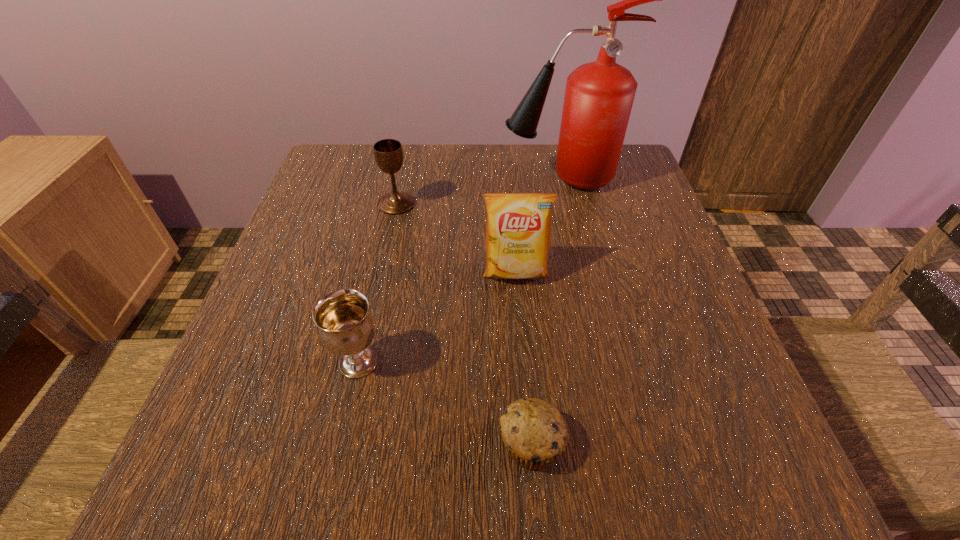
Image resolution: width=960 pixels, height=540 pixels. I want to click on free space that is in between the farther chalice and the fourth farthest object, so click(x=378, y=283).

Locate an element on the screen. This screenshot has width=960, height=540. empty space that is in between the farther chalice and the second nearest object is located at coordinates (378, 283).

Find the location of a particular element. Image resolution: width=960 pixels, height=540 pixels. free space between the fire extinguisher and the farther chalice is located at coordinates (478, 191).

Where is `vacant area between the third farthest object and the farther chalice`? The width and height of the screenshot is (960, 540). vacant area between the third farthest object and the farther chalice is located at coordinates (456, 239).

Locate an element on the screen. This screenshot has width=960, height=540. empty space between the crisp (potato chip) and the nearer chalice is located at coordinates (437, 318).

Select which object appears as the fourth closest to the tallest object. Please provide its 2D coordinates. Your answer should be formatted as a tuple, i.e. [(x, y)], where the tuple contains the x and y coordinates of a point satisfying the conditions above.

[(534, 432)]

Locate which object is the third closest to the shortest object. Please provide its 2D coordinates. Your answer should be formatted as a tuple, i.e. [(x, y)], where the tuple contains the x and y coordinates of a point satisfying the conditions above.

[(388, 153)]

The image size is (960, 540). In order to click on vacant area that satisfies the following two spatial constraints: 1. with the nozzle aimed from the tallest object; 2. on the front-facing side of the crisp (potato chip) in this screenshot , I will do (581, 273).

Locate an element on the screen. This screenshot has width=960, height=540. vacant space that satisfies the following two spatial constraints: 1. on the front side of the nearest object; 2. on the right side of the nearer chalice is located at coordinates (341, 443).

The height and width of the screenshot is (540, 960). In order to click on vacant point that satisfies the following two spatial constraints: 1. on the front side of the shortest object; 2. on the right side of the second nearest object in this screenshot , I will do `click(341, 443)`.